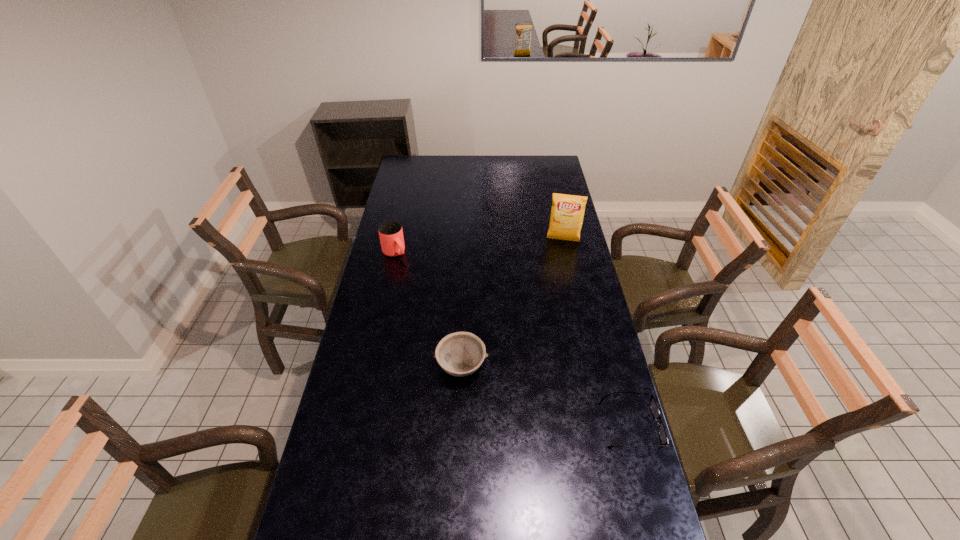
At what (x,y) coordinates should I click in order to perform the action: click on vacant space that is in between the crisp (potato chip) and the cup. Please return your answer as a coordinate pair (x, y). The width and height of the screenshot is (960, 540). Looking at the image, I should click on (479, 246).

Identify the location of object that ranks as the second closest to the third shortest object. This screenshot has width=960, height=540. (567, 212).

This screenshot has width=960, height=540. I want to click on object that ranks as the closest to the tallest object, so click(x=390, y=232).

This screenshot has width=960, height=540. I want to click on blank space that satisfies the following two spatial constraints: 1. on the back side of the third farthest object; 2. on the right side of the crisp (potato chip), so click(x=467, y=240).

The width and height of the screenshot is (960, 540). I want to click on vacant area in the image that satisfies the following two spatial constraints: 1. on the front side of the shortest object; 2. on the front-facing side of the second object from left to right, so click(x=460, y=425).

Image resolution: width=960 pixels, height=540 pixels. What are the coordinates of `vacant space that satisfies the following two spatial constraints: 1. on the front side of the nearest object; 2. on the front-facing side of the bowl` in the screenshot? It's located at (460, 425).

This screenshot has width=960, height=540. In order to click on vacant area in the image that satisfies the following two spatial constraints: 1. on the front side of the shortest object; 2. on the front-facing side of the tallest object in this screenshot , I will do coord(604,425).

Image resolution: width=960 pixels, height=540 pixels. I want to click on vacant area that satisfies the following two spatial constraints: 1. on the front side of the bowl; 2. on the left side of the second tallest object, so click(370, 367).

Identify the location of free location that satisfies the following two spatial constraints: 1. on the back side of the tallest object; 2. on the left side of the bowl. This screenshot has height=540, width=960. (467, 240).

Locate an element on the screen. The height and width of the screenshot is (540, 960). free spot that satisfies the following two spatial constraints: 1. on the front side of the cup; 2. on the left side of the bowl is located at coordinates [370, 367].